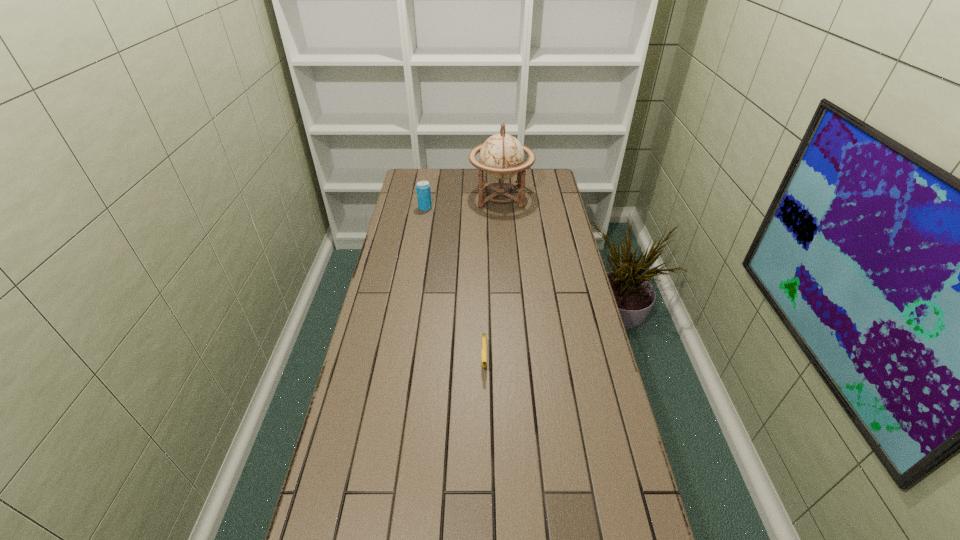
Locate an element on the screen. The height and width of the screenshot is (540, 960). object located at the far edge is located at coordinates (501, 156).

This screenshot has height=540, width=960. Identify the location of object present at the left edge. (423, 187).

The height and width of the screenshot is (540, 960). I want to click on object present at the right edge, so [501, 156].

At what (x,y) coordinates should I click in order to perform the action: click on object at the far right corner. Please return your answer as a coordinate pair (x, y). The image size is (960, 540). Looking at the image, I should click on (501, 156).

Locate an element on the screen. The width and height of the screenshot is (960, 540). vacant space at the left edge of the desktop is located at coordinates point(398,220).

The image size is (960, 540). In the image, there is a desktop. What are the coordinates of `free space at the right edge` in the screenshot? It's located at (569, 385).

The width and height of the screenshot is (960, 540). What are the coordinates of `vacant area at the far left corner` in the screenshot? It's located at (424, 180).

Find the location of a particular element. Image resolution: width=960 pixels, height=540 pixels. free space that is in between the shortest object and the tallest object is located at coordinates (492, 278).

I want to click on free space between the banana and the tallest object, so click(492, 278).

The image size is (960, 540). What are the coordinates of `unoccupied area between the leftmost object and the nearest object` in the screenshot? It's located at (455, 284).